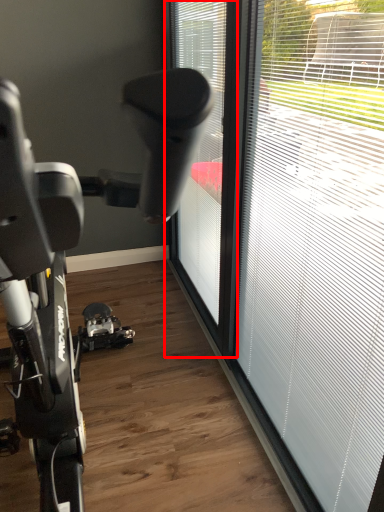
Question: Observing the image, what is the correct spatial positioning of window (annotated by the red box) in reference to window?

Choices:
 (A) left
 (B) right

Answer: (A)